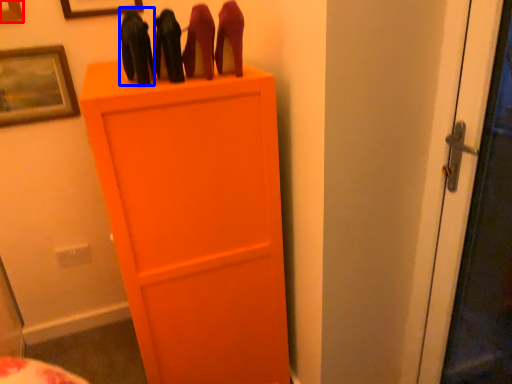
Question: Which of the following is the closest to the observer, picture frame (highlighted by a red box) or stuff (highlighted by a blue box)?

Choices:
 (A) picture frame
 (B) stuff

Answer: (B)